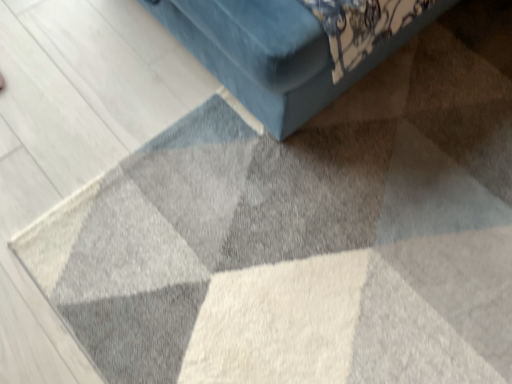
What is the approximate width of gray soft rug at center?

36.73 inches.

Describe the element at coordinates (291, 254) in the screenshot. I see `gray soft rug at center` at that location.

Find the location of `gray soft rug at center`. gray soft rug at center is located at coordinates (291, 254).

Locate an element on the screen. gray soft rug at center is located at coordinates (291, 254).